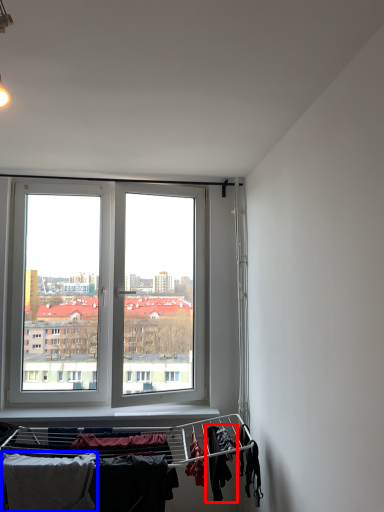
Question: Among these objects, which one is nearest to the camera, clothing (highlighted by a red box) or clothing (highlighted by a blue box)?

Choices:
 (A) clothing
 (B) clothing

Answer: (B)